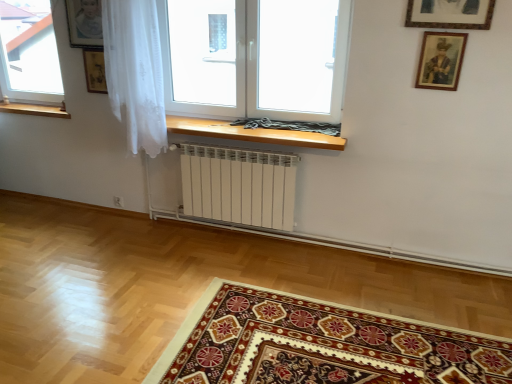
Question: Is transparent glass window at upper left, the 1th window from the left, in front of or behind carpet with intricate patterns at lower center in the image?

Choices:
 (A) front
 (B) behind

Answer: (B)

Question: Considering the positions of transparent glass window at upper left, the 1th window from the left, and carpet with intricate patterns at lower center in the image, is transparent glass window at upper left, the 1th window from the left, taller or shorter than carpet with intricate patterns at lower center?

Choices:
 (A) short
 (B) tall

Answer: (B)

Question: Which object is the farthest from the transparent glass window at upper left, the 1th window from the left?

Choices:
 (A) carpet with intricate patterns at lower center
 (B) transparent glass window at center, the second window positioned from the left

Answer: (A)

Question: Estimate the real-world distances between objects in this image. Which object is closer to the transparent glass window at upper left, the 1th window from the left?

Choices:
 (A) transparent glass window at center, the second window positioned from the left
 (B) carpet with intricate patterns at lower center

Answer: (A)